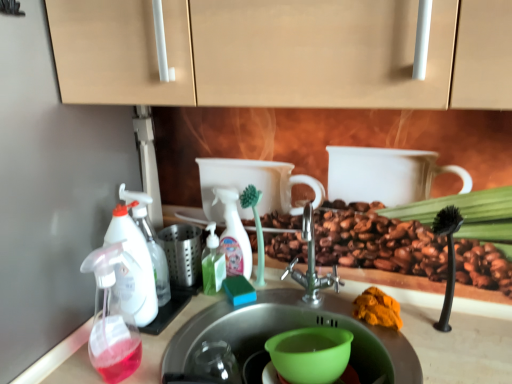
Question: Should I look upward or downward to see translucent plastic soap dispenser at left, which appears as the 2th soap dispenser when viewed from the front?

Choices:
 (A) up
 (B) down

Answer: (B)

Question: Considering the relative sizes of orange powder at sink and translucent plastic spray bottle at center in the image provided, is orange powder at sink taller than translucent plastic spray bottle at center?

Choices:
 (A) no
 (B) yes

Answer: (A)

Question: Is orange powder at sink wider than translucent plastic spray bottle at center?

Choices:
 (A) yes
 (B) no

Answer: (A)

Question: From the image's perspective, is orange powder at sink on translucent plastic spray bottle at center?

Choices:
 (A) no
 (B) yes

Answer: (A)

Question: Is orange powder at sink aimed at translucent plastic spray bottle at center?

Choices:
 (A) no
 (B) yes

Answer: (A)

Question: From a real-world perspective, is orange powder at sink under translucent plastic spray bottle at center?

Choices:
 (A) yes
 (B) no

Answer: (A)

Question: Is orange powder at sink to the left of translucent plastic spray bottle at center from the viewer's perspective?

Choices:
 (A) no
 (B) yes

Answer: (A)

Question: Can you confirm if green plastic cup at sink is shorter than translucent plastic soap dispenser at left, which appears as the 2th soap dispenser when viewed from the front?

Choices:
 (A) no
 (B) yes

Answer: (B)

Question: Would you say translucent plastic soap dispenser at left, positioned as the third soap dispenser in right-to-left order, is part of green plastic cup at sink's contents?

Choices:
 (A) yes
 (B) no

Answer: (B)

Question: From the image's perspective, is green plastic cup at sink below translucent plastic soap dispenser at left, positioned as the third soap dispenser in right-to-left order?

Choices:
 (A) yes
 (B) no

Answer: (A)

Question: Is translucent plastic soap dispenser at left, the 1th soap dispenser when ordered from left to right, at the back of green plastic cup at sink?

Choices:
 (A) no
 (B) yes

Answer: (A)

Question: Is green plastic cup at sink oriented towards translucent plastic soap dispenser at left, positioned as the third soap dispenser in right-to-left order?

Choices:
 (A) yes
 (B) no

Answer: (B)

Question: Is green plastic cup at sink outside of translucent plastic soap dispenser at left, which appears as the 2th soap dispenser when viewed from the front?

Choices:
 (A) yes
 (B) no

Answer: (A)

Question: Is stainless steel sink at center, the 1th sink positioned from the top, not within green plastic cup at sink?

Choices:
 (A) no
 (B) yes

Answer: (B)